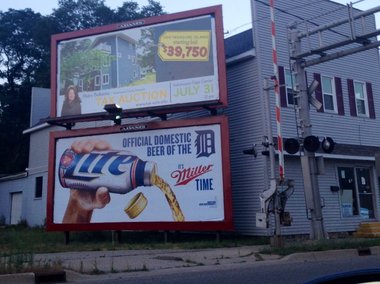
What are the coordinates of `bar` in the screenshot? It's located at (273, 90).